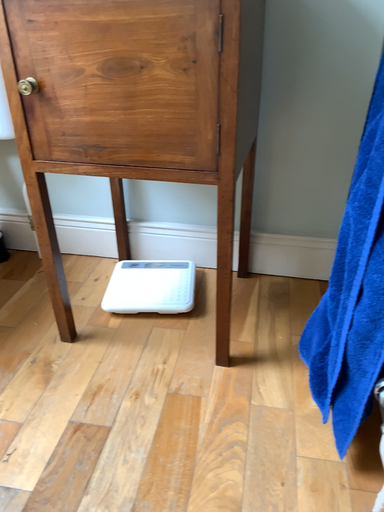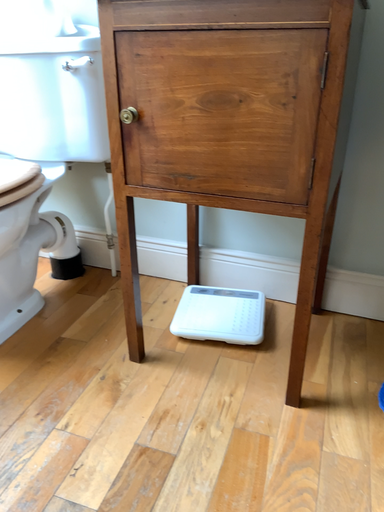
Question: Which way did the camera rotate in the video?

Choices:
 (A) rotated left
 (B) rotated right

Answer: (A)